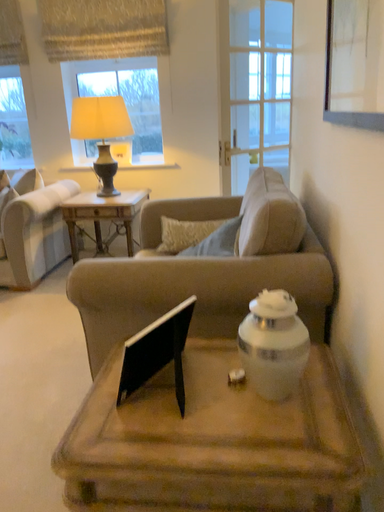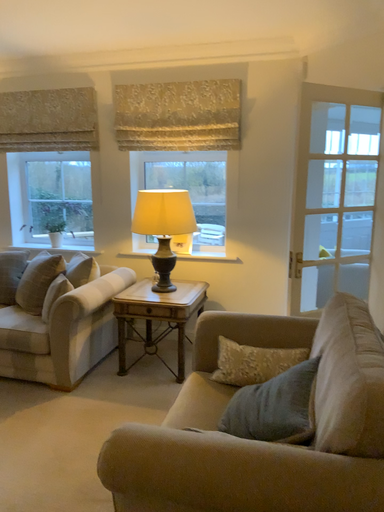
Question: Which way did the camera rotate in the video?

Choices:
 (A) rotated left
 (B) rotated right

Answer: (A)